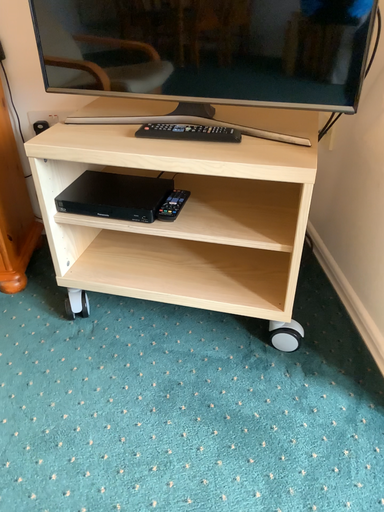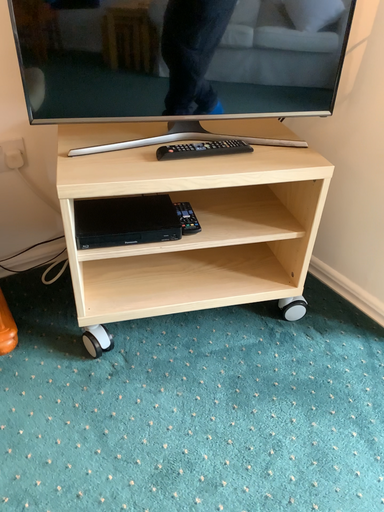
Question: How did the camera likely rotate when shooting the video?

Choices:
 (A) rotated right
 (B) rotated left

Answer: (A)